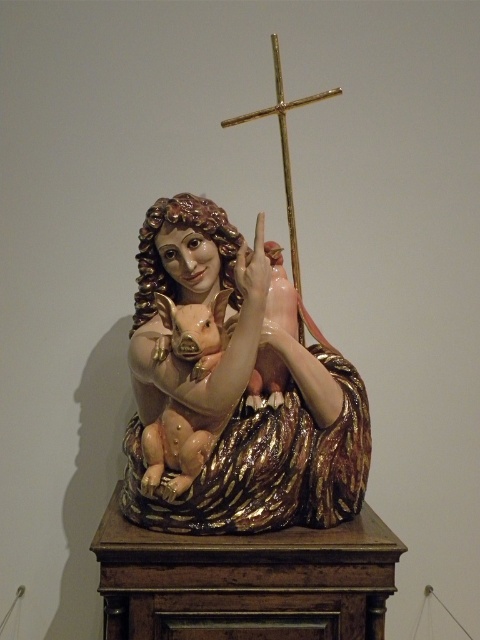
You are an art conservator who needs to install a protective glass cover over both the glossy ceramic statue at center and the gold polished cross at upper center. The glass cover must be large enough to cover both objects without touching them. What is the minimum distance the glass cover needs to extend beyond the edges of both objects combined?

The glossy ceramic statue at center and gold polished cross at upper center are 8.31 inches apart from each other. To ensure the glass cover does not touch either object, the minimum distance it needs to extend beyond both edges combined would be at least 8.31 inches plus twice the required clearance around each object. However, without specific clearance requirements, the base distance between them is 8.31 inches.

You are an art curator planning to install a motion sensor to monitor the glossy ceramic statue at center. The sensor has a detection range of 0.5 meters in all directions from its placement point. If you want to ensure the sensor can detect the statue, where should you place the sensor?

The glossy ceramic statue at center is located at point (x=241, y=388). To ensure the sensor detects it, place the sensor within 0.5 meters of this coordinate in any direction.